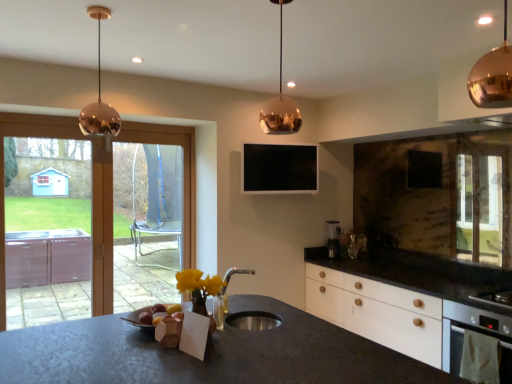
Find the location of a particular element. The image size is (512, 384). black glossy tv at upper center is located at coordinates (280, 168).

Describe the element at coordinates (145, 318) in the screenshot. Image resolution: width=512 pixels, height=384 pixels. I see `matte brown bread at center` at that location.

How much space does copper metallic pendant light at upper center, the 2th lamp when ordered from left to right, occupy vertically?

The height of copper metallic pendant light at upper center, the 2th lamp when ordered from left to right, is 21.94 inches.

The image size is (512, 384). I want to click on clear glass screen door at left, acting as the 1th screen door starting from the right, so click(x=153, y=207).

Find the location of `white matte oven at lower right`. white matte oven at lower right is located at coordinates (462, 349).

You are a GUI agent. You are given a task and a screenshot of the screen. Output one action in this format:
    pyautogui.click(x=<x>, y=<y>)
    Task: Click on the black glossy tv at upper center
    The image size is (512, 384).
    Given the screenshot: What is the action you would take?
    pyautogui.click(x=280, y=168)

Considering the positions of points (180, 138) and (281, 25), is point (180, 138) closer to camera compared to point (281, 25)?

No, it is behind (281, 25).

Is transparent glass door at left positioned far away from copper metallic pendant light at upper center, the 2th lamp when ordered from left to right?

Yes, transparent glass door at left is far from copper metallic pendant light at upper center, the 2th lamp when ordered from left to right.

Is transparent glass door at left shorter than copper metallic pendant light at upper center, acting as the second lamp starting from the front?

Incorrect, the height of transparent glass door at left does not fall short of that of copper metallic pendant light at upper center, acting as the second lamp starting from the front.

Considering the relative sizes of transparent glass door at left and copper metallic pendant light at upper center, the 2th lamp when ordered from left to right, in the image provided, is transparent glass door at left bigger than copper metallic pendant light at upper center, the 2th lamp when ordered from left to right,?

Yes, transparent glass door at left is bigger than copper metallic pendant light at upper center, the 2th lamp when ordered from left to right.

From the image's perspective, is copper metallic pendant light at upper center, acting as the second lamp starting from the front, located above or below satin silver coffee machine at right?

Based on their image positions, copper metallic pendant light at upper center, acting as the second lamp starting from the front, is located above satin silver coffee machine at right.

Which object is closer to the camera, copper metallic pendant light at upper center, the second lamp when ordered from back to front, or satin silver coffee machine at right?

copper metallic pendant light at upper center, the second lamp when ordered from back to front.

Does copper metallic pendant light at upper center, placed as the second lamp when sorted from right to left, have a larger size compared to satin silver coffee machine at right?

Correct, copper metallic pendant light at upper center, placed as the second lamp when sorted from right to left, is larger in size than satin silver coffee machine at right.

Locate an element on the screen. This screenshot has height=384, width=512. coffee machine beneath the copper metallic pendant light at upper center, acting as the second lamp starting from the front (from a real-world perspective) is located at coordinates (333, 239).

Between copper metallic pendant light at upper center, placed as the second lamp when sorted from right to left, and transparent glass screen door at left, positioned as the first screen door in left-to-right order, which one has larger size?

Bigger between the two is transparent glass screen door at left, positioned as the first screen door in left-to-right order.

Does copper metallic pendant light at upper center, placed as the second lamp when sorted from right to left, come behind transparent glass screen door at left, the 2th screen door when ordered from back to front?

No, copper metallic pendant light at upper center, placed as the second lamp when sorted from right to left, is in front of transparent glass screen door at left, the 2th screen door when ordered from back to front.

Measure the distance from copper metallic pendant light at upper center, acting as the second lamp starting from the front, to transparent glass screen door at left, positioned as the first screen door in left-to-right order.

They are 7.54 feet apart.

Is copper metallic pendant light at upper center, placed as the second lamp when sorted from right to left, outside of transparent glass screen door at left, the 2th screen door when ordered from back to front?

Yes.

How different are the orientations of transparent glass screen door at left, positioned as the first screen door in left-to-right order, and satin silver coffee machine at right in degrees?

They differ by 46.6 degrees in their facing directions.

Image resolution: width=512 pixels, height=384 pixels. I want to click on coffee machine that appears below the transparent glass screen door at left, the first screen door from the front (from the image's perspective), so click(x=333, y=239).

From a real-world perspective, does transparent glass screen door at left, positioned as the first screen door in left-to-right order, stand above satin silver coffee machine at right?

Yes, from a real-world perspective, transparent glass screen door at left, positioned as the first screen door in left-to-right order, is above satin silver coffee machine at right.

Does transparent glass screen door at left, positioned as the first screen door in left-to-right order, turn towards satin silver coffee machine at right?

No, transparent glass screen door at left, positioned as the first screen door in left-to-right order, is not turned towards satin silver coffee machine at right.

Would you consider copper/metallic pendant light at upper left, which appears as the 1th lamp when viewed from the left, to be distant from clear glass screen door at left, which is the 2th screen door in front-to-back order?

Indeed, copper/metallic pendant light at upper left, which appears as the 1th lamp when viewed from the left, is not near clear glass screen door at left, which is the 2th screen door in front-to-back order.

Is copper/metallic pendant light at upper left, the 3th lamp when ordered from right to left, oriented towards clear glass screen door at left, acting as the 1th screen door starting from the back?

No, copper/metallic pendant light at upper left, the 3th lamp when ordered from right to left, is not turned towards clear glass screen door at left, acting as the 1th screen door starting from the back.

Which of these two, copper/metallic pendant light at upper left, which appears as the 1th lamp when viewed from the left, or clear glass screen door at left, acting as the 1th screen door starting from the right, is bigger?

With larger size is clear glass screen door at left, acting as the 1th screen door starting from the right.

Which is more to the right, matte brown bread at center or copper/metallic pendant light at upper right, which is the first lamp from right to left?

copper/metallic pendant light at upper right, which is the first lamp from right to left, is more to the right.

Who is taller, matte brown bread at center or copper/metallic pendant light at upper right, the third lamp in the left-to-right sequence?

copper/metallic pendant light at upper right, the third lamp in the left-to-right sequence.

From a real-world perspective, is matte brown bread at center physically below copper/metallic pendant light at upper right, positioned as the 3th lamp in back-to-front order?

Yes, from a real-world perspective, matte brown bread at center is beneath copper/metallic pendant light at upper right, positioned as the 3th lamp in back-to-front order.

Can you see copper/metallic pendant light at upper right, positioned as the 3th lamp in back-to-front order, touching copper/metallic pendant light at upper left, marked as the 1th lamp in a back-to-front arrangement?

No, copper/metallic pendant light at upper right, positioned as the 3th lamp in back-to-front order, is not touching copper/metallic pendant light at upper left, marked as the 1th lamp in a back-to-front arrangement.

Can you tell me how much copper/metallic pendant light at upper right, positioned as the 3th lamp in back-to-front order, and copper/metallic pendant light at upper left, which is the third lamp from front to back, differ in facing direction?

The angular difference between copper/metallic pendant light at upper right, positioned as the 3th lamp in back-to-front order, and copper/metallic pendant light at upper left, which is the third lamp from front to back, is 87.6 degrees.

Between point (495, 48) and point (109, 119), which one is positioned in front?

Positioned in front is point (109, 119).

Choose the correct answer: Is copper/metallic pendant light at upper right, positioned as the 3th lamp in back-to-front order, inside copper/metallic pendant light at upper left, which is the third lamp from front to back, or outside it?

copper/metallic pendant light at upper right, positioned as the 3th lamp in back-to-front order, is located beyond the bounds of copper/metallic pendant light at upper left, which is the third lamp from front to back.

The width and height of the screenshot is (512, 384). What are the coordinates of `window located on the left of copper metallic pendant light at upper center, acting as the second lamp starting from the front` in the screenshot? It's located at (183, 171).

I want to click on coffee machine behind the copper metallic pendant light at upper center, the second lamp when ordered from back to front, so click(x=333, y=239).

From the image, which object appears to be farther from copper/metallic pendant light at upper right, the first lamp viewed from the front, clear glass screen door at left, acting as the 1th screen door starting from the right, or transparent glass door at left?

clear glass screen door at left, acting as the 1th screen door starting from the right, lies further to copper/metallic pendant light at upper right, the first lamp viewed from the front, than the other object.

In the scene shown: From the image, which object appears to be nearer to transparent glass screen door at left, the 2th screen door when ordered from back to front, copper metallic pendant light at upper center, acting as the second lamp starting from the front, or copper/metallic pendant light at upper left, which appears as the 1th lamp when viewed from the left?

copper/metallic pendant light at upper left, which appears as the 1th lamp when viewed from the left, is positioned closer to the anchor transparent glass screen door at left, the 2th screen door when ordered from back to front.

Based on their spatial positions, is copper/metallic pendant light at upper left, the 3th lamp when ordered from right to left, or copper/metallic pendant light at upper right, the first lamp viewed from the front, further from white matte oven at lower right?

The object further to white matte oven at lower right is copper/metallic pendant light at upper left, the 3th lamp when ordered from right to left.

Estimate the real-world distances between objects in this image. Which object is further from transparent glass screen door at left, the first screen door from the front, transparent glass door at left or copper metallic pendant light at upper center, the second lamp when ordered from back to front?

copper metallic pendant light at upper center, the second lamp when ordered from back to front.

Looking at the image, which one is located closer to copper/metallic pendant light at upper left, which is the third lamp from front to back, copper/metallic pendant light at upper right, positioned as the 3th lamp in back-to-front order, or black glossy tv at upper center?

black glossy tv at upper center is closer to copper/metallic pendant light at upper left, which is the third lamp from front to back.

Looking at the image, which one is located further to copper metallic pendant light at upper center, the 2th lamp when ordered from left to right, clear glass screen door at left, acting as the 1th screen door starting from the right, or copper/metallic pendant light at upper right, which is the first lamp from right to left?

clear glass screen door at left, acting as the 1th screen door starting from the right.

Considering their positions, is transparent glass screen door at left, positioned as the first screen door in left-to-right order, positioned further to clear glass screen door at left, acting as the 1th screen door starting from the right, than matte brown bread at center?

Among the two, matte brown bread at center is located further to clear glass screen door at left, acting as the 1th screen door starting from the right.

Looking at the image, which one is located closer to copper/metallic pendant light at upper left, marked as the 1th lamp in a back-to-front arrangement, satin silver coffee machine at right or clear glass screen door at left, which is the 2th screen door in front-to-back order?

clear glass screen door at left, which is the 2th screen door in front-to-back order, is positioned closer to the anchor copper/metallic pendant light at upper left, marked as the 1th lamp in a back-to-front arrangement.

Find the location of a particular element. The width and height of the screenshot is (512, 384). window between transparent glass screen door at left, the first screen door from the front, and copper/metallic pendant light at upper right, positioned as the 3th lamp in back-to-front order, from left to right is located at coordinates (183, 171).

At what (x,y) coordinates should I click in order to perform the action: click on food between copper/metallic pendant light at upper left, the 3th lamp when ordered from right to left, and clear glass screen door at left, which is the 2th screen door in front-to-back order, in the front-back direction. Please return your answer as a coordinate pair (x, y). This screenshot has width=512, height=384. Looking at the image, I should click on (145, 318).

Image resolution: width=512 pixels, height=384 pixels. I want to click on window between copper/metallic pendant light at upper left, the 3th lamp when ordered from right to left, and transparent glass screen door at left, the first screen door from the front, in the front-back direction, so click(183, 171).

Locate an element on the screen. This screenshot has width=512, height=384. food between transparent glass screen door at left, positioned as the first screen door in left-to-right order, and copper/metallic pendant light at upper right, the first lamp viewed from the front is located at coordinates (145, 318).